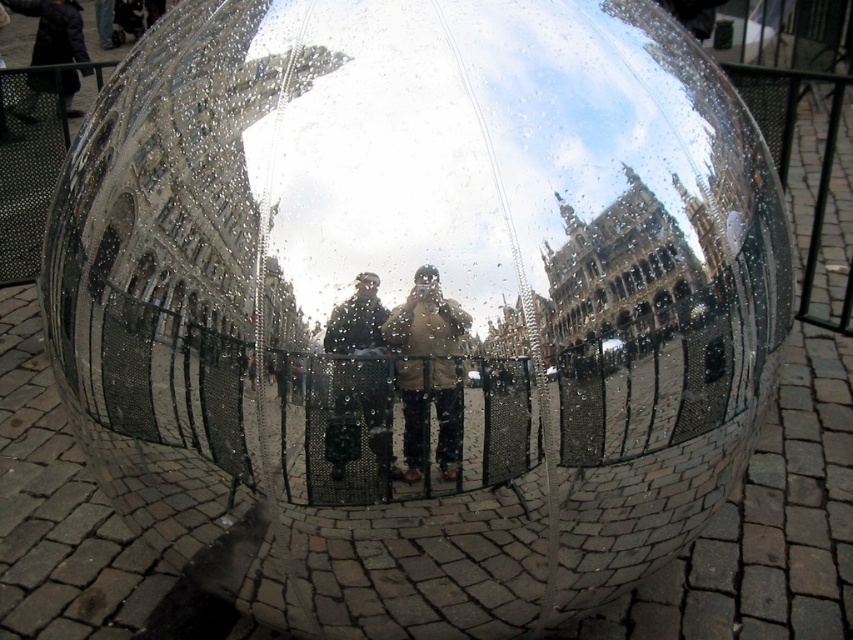
Is point (442, 396) behind point (357, 289)?

That is True.

In the scene shown: Does brown leather jacket at center come in front of dark gray fabric jacket at center?

Yes, it is in front of dark gray fabric jacket at center.

The width and height of the screenshot is (853, 640). What are the coordinates of `brown leather jacket at center` in the screenshot? It's located at (427, 369).

Does brown leather jacket at center have a smaller size compared to dark blue jacket at upper left?

Yes, brown leather jacket at center is smaller than dark blue jacket at upper left.

The width and height of the screenshot is (853, 640). Describe the element at coordinates (427, 369) in the screenshot. I see `brown leather jacket at center` at that location.

You are a GUI agent. You are given a task and a screenshot of the screen. Output one action in this format:
    pyautogui.click(x=<x>, y=<y>)
    Task: Click on the brown leather jacket at center
    The width and height of the screenshot is (853, 640).
    Given the screenshot: What is the action you would take?
    pyautogui.click(x=427, y=369)

You are a GUI agent. You are given a task and a screenshot of the screen. Output one action in this format:
    pyautogui.click(x=<x>, y=<y>)
    Task: Click on the dark gray fabric jacket at center
    
    Given the screenshot: What is the action you would take?
    pyautogui.click(x=357, y=321)

The width and height of the screenshot is (853, 640). Find the location of `dark gray fabric jacket at center`. dark gray fabric jacket at center is located at coordinates (357, 321).